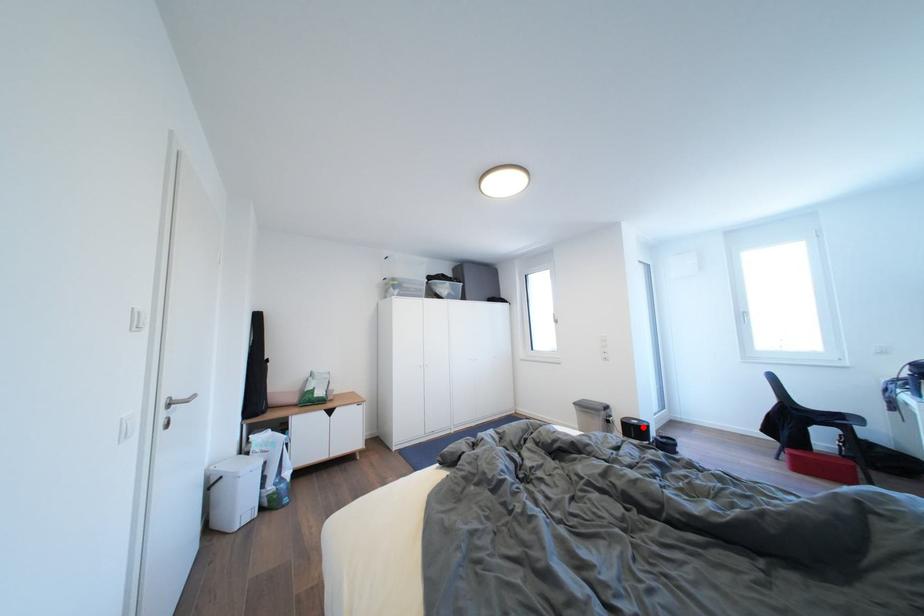
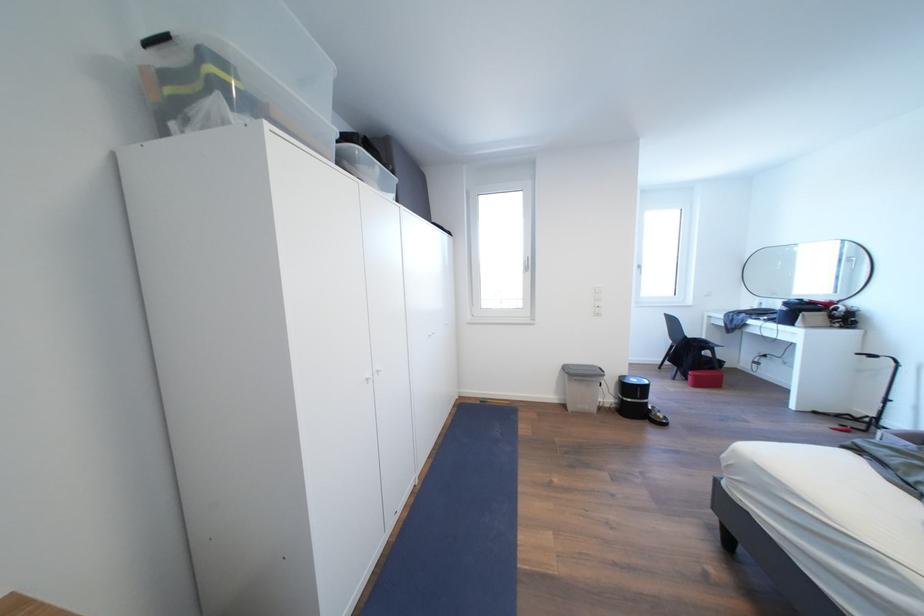
Question: I am providing you with two images of the same scene from different viewpoints. A red point is marked on the first image. Can you still see the location of the red point in image 2?

Choices:
 (A) Yes
 (B) No

Answer: (A)